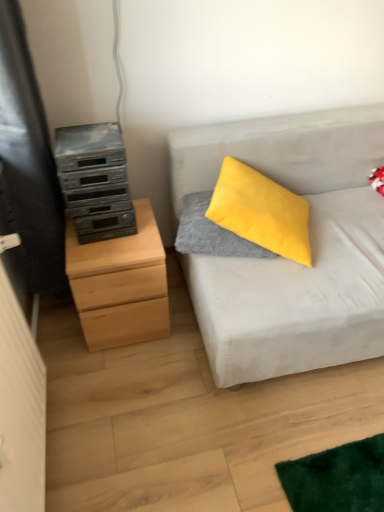
Question: Should I look upward or downward to see natural wood chest of drawers at left?

Choices:
 (A) up
 (B) down

Answer: (B)

Question: Considering the relative sizes of light gray fabric couch at right and velvety gray pillow at center in the image provided, is light gray fabric couch at right smaller than velvety gray pillow at center?

Choices:
 (A) yes
 (B) no

Answer: (B)

Question: Would you say velvety gray pillow at center is part of light gray fabric couch at right's contents?

Choices:
 (A) yes
 (B) no

Answer: (A)

Question: Does light gray fabric couch at right have a greater width compared to velvety gray pillow at center?

Choices:
 (A) no
 (B) yes

Answer: (B)

Question: Does light gray fabric couch at right come in front of velvety gray pillow at center?

Choices:
 (A) yes
 (B) no

Answer: (A)

Question: Considering the relative sizes of light gray fabric couch at right and velvety gray pillow at center in the image provided, is light gray fabric couch at right taller than velvety gray pillow at center?

Choices:
 (A) no
 (B) yes

Answer: (B)

Question: Does light gray fabric couch at right appear on the right side of velvety gray pillow at center?

Choices:
 (A) no
 (B) yes

Answer: (B)

Question: Is light gray fabric couch at right taller than silver metallic stereo at left?

Choices:
 (A) yes
 (B) no

Answer: (A)

Question: Does light gray fabric couch at right come in front of silver metallic stereo at left?

Choices:
 (A) no
 (B) yes

Answer: (B)

Question: Is light gray fabric couch at right positioned beyond the bounds of silver metallic stereo at left?

Choices:
 (A) no
 (B) yes

Answer: (B)

Question: Does light gray fabric couch at right have a smaller size compared to silver metallic stereo at left?

Choices:
 (A) yes
 (B) no

Answer: (B)

Question: From a real-world perspective, is light gray fabric couch at right below silver metallic stereo at left?

Choices:
 (A) yes
 (B) no

Answer: (A)

Question: From the image's perspective, is light gray fabric couch at right located above silver metallic stereo at left?

Choices:
 (A) no
 (B) yes

Answer: (A)

Question: Can natural wood chest of drawers at left be found inside light gray fabric couch at right?

Choices:
 (A) no
 (B) yes

Answer: (A)